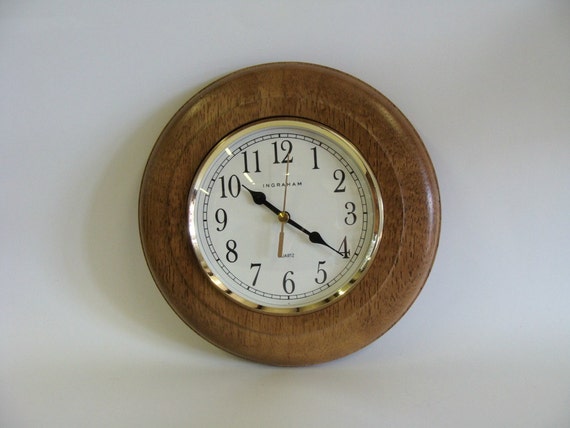
This screenshot has width=570, height=428. I want to click on wall, so click(x=465, y=63).